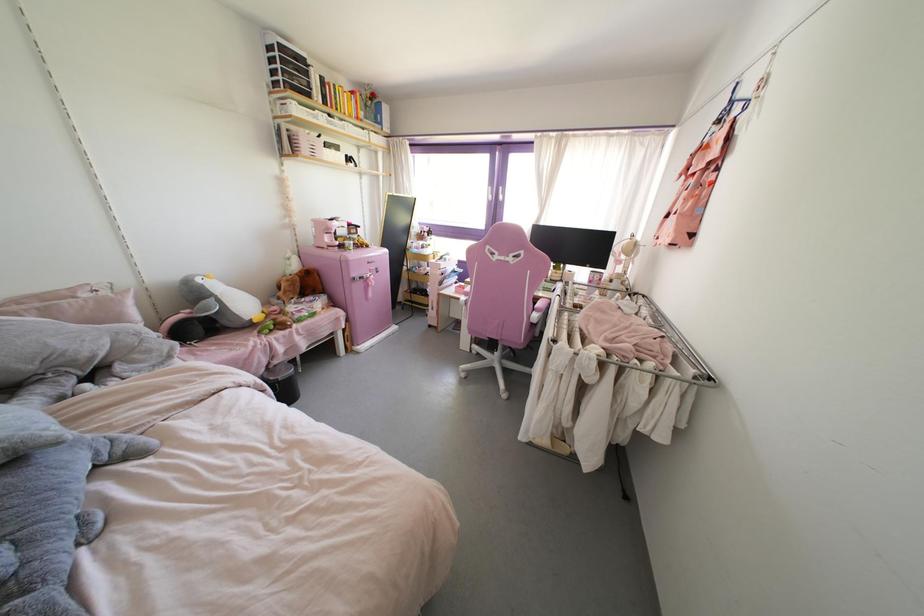
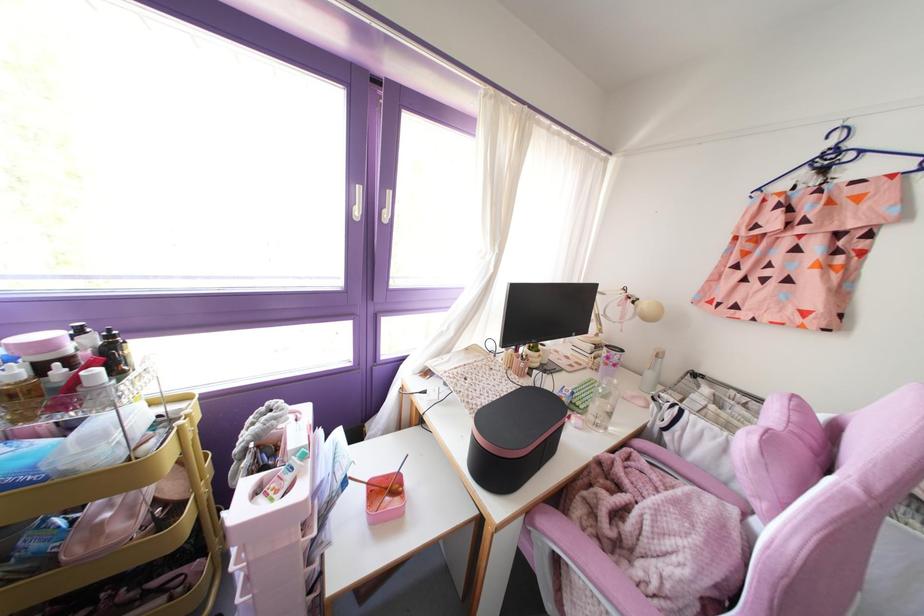
Locate, in the second image, the point that corresponds to (489,197) in the first image.

(357, 212)